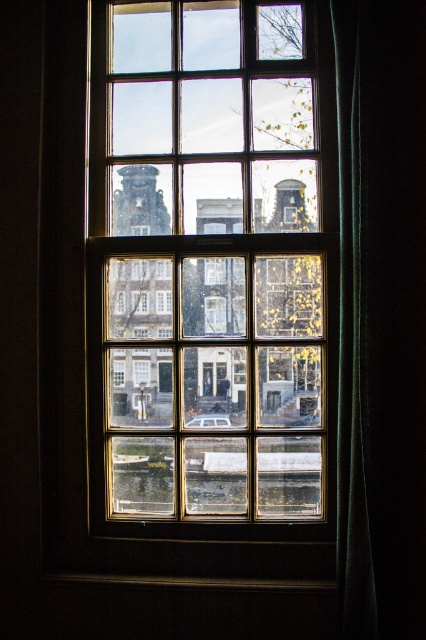
You are standing in a room with a large window. You notice two points outside through the window, one at coordinate point (368, 616) and the other at point (287, 580). Which point is closer to you?

Point (368, 616) is closer to the camera than point (287, 580).